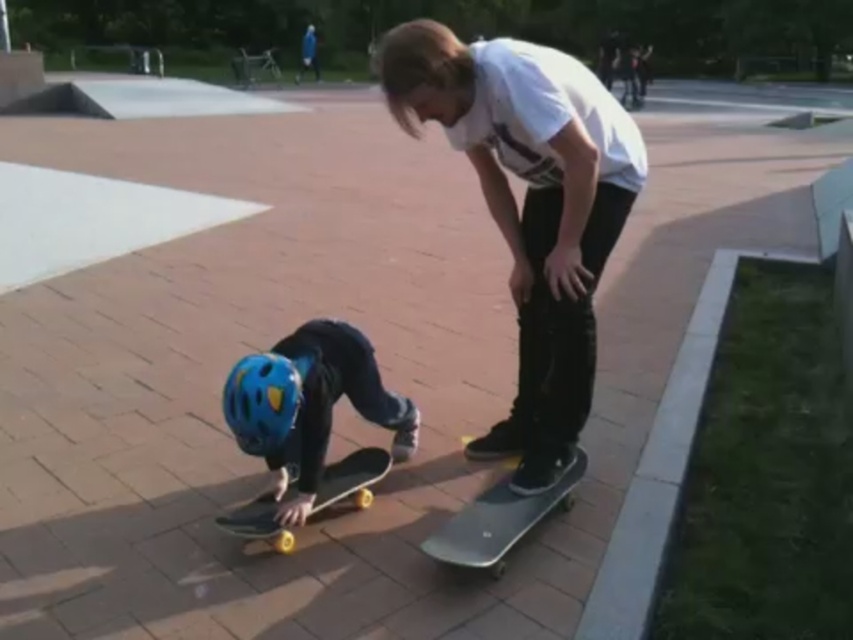
In the scene shown: Is smooth gray skateboard at center below blue matte helmet at lower center?

Indeed, smooth gray skateboard at center is positioned under blue matte helmet at lower center.

Where is `smooth gray skateboard at center`? smooth gray skateboard at center is located at coordinates (498, 520).

Can you confirm if smooth gray skateboard at center is wider than yellow rubber skateboard at lower center?

Yes, smooth gray skateboard at center is wider than yellow rubber skateboard at lower center.

The width and height of the screenshot is (853, 640). I want to click on smooth gray skateboard at center, so click(x=498, y=520).

This screenshot has height=640, width=853. I want to click on smooth gray skateboard at center, so click(x=498, y=520).

Which is behind, point (553, 228) or point (223, 416)?

Point (553, 228)

Is point (419, 115) positioned after point (260, 400)?

Yes, it is behind point (260, 400).

Where is `matte black skateboard at center`? matte black skateboard at center is located at coordinates (531, 209).